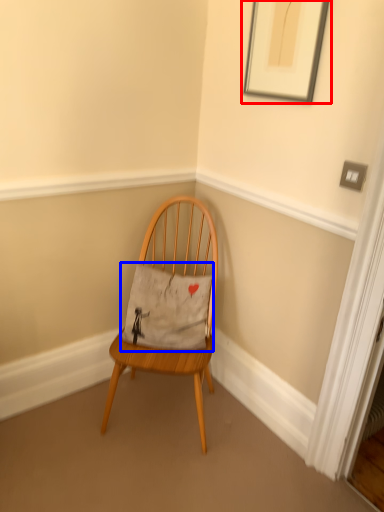
Question: Which of the following is the farthest to the observer, picture frame (highlighted by a red box) or pillow (highlighted by a blue box)?

Choices:
 (A) picture frame
 (B) pillow

Answer: (B)